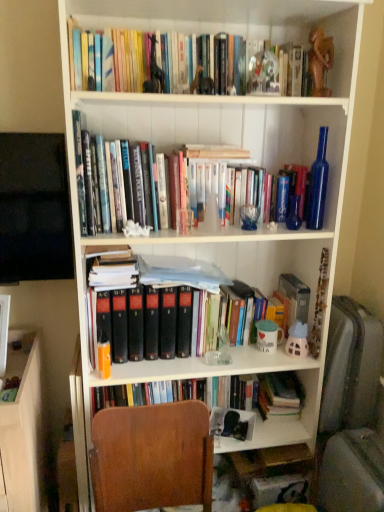
Question: Relative to hardcover books at upper center, which is counted as the 2th book, starting from the bottom, is brown wood chair at lower center in front or behind?

Choices:
 (A) behind
 (B) front

Answer: (B)

Question: Do you think brown wood chair at lower center is within hardcover books at upper center, which ranks as the 2th book in back-to-front order, or outside of it?

Choices:
 (A) outside
 (B) inside

Answer: (A)

Question: Considering the real-world distances, which object is farthest from the hardcover books at lower center, arranged as the first book when viewed from the back?

Choices:
 (A) hardcover book at center
 (B) hardcover books at upper center, which ranks as the 2th book in back-to-front order
 (C) white glossy mug at middle right
 (D) brown wood chair at lower center

Answer: (B)

Question: Estimate the real-world distances between objects in this image. Which object is farther from the hardcover book at center?

Choices:
 (A) hardcover books at upper center, placed as the first book when sorted from top to bottom
 (B) hardcover books at lower center, arranged as the first book when viewed from the back
 (C) white glossy mug at middle right
 (D) brown wood chair at lower center

Answer: (A)